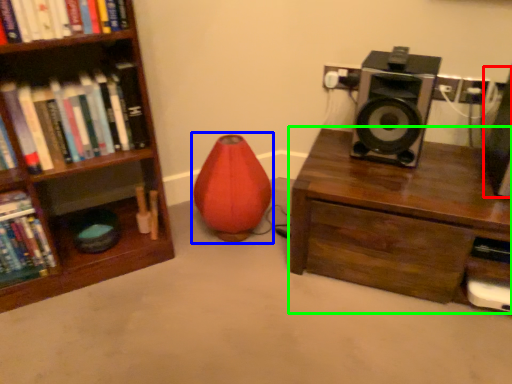
Question: Estimate the real-world distances between objects in this image. Which object is closer to speaker (highlighted by a red box), bean bag chair (highlighted by a blue box) or desk (highlighted by a green box)?

Choices:
 (A) bean bag chair
 (B) desk

Answer: (B)